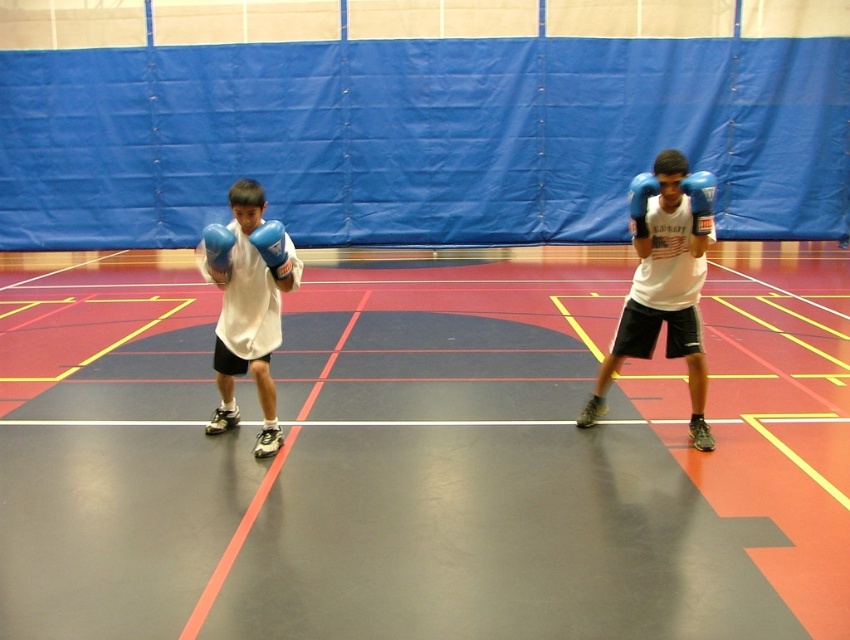
Question: Which object appears closest to the camera in this image?

Choices:
 (A) blue matte boxing glove at upper right
 (B) blue synthetic boxing glove at right

Answer: (A)

Question: Which of the following is the closest to the observer?

Choices:
 (A) blue synthetic boxing glove at right
 (B) blue matte boxing glove at upper right
 (C) blue matte boxing glove at upper center
 (D) blue matte boxing glove at left

Answer: (B)

Question: Does blue matte boxing glove at upper right appear on the right side of blue matte boxing glove at left?

Choices:
 (A) no
 (B) yes

Answer: (B)

Question: Which point is closer to the camera?

Choices:
 (A) blue matte boxing glove at upper center
 (B) matte blue gloves at center
 (C) blue synthetic boxing glove at right
 (D) blue matte boxing glove at upper right

Answer: (B)

Question: Does blue matte boxing glove at upper right appear on the right side of blue matte boxing glove at left?

Choices:
 (A) yes
 (B) no

Answer: (A)

Question: Considering the relative positions of white matte shirt at left and blue matte boxing glove at upper center in the image provided, where is white matte shirt at left located with respect to blue matte boxing glove at upper center?

Choices:
 (A) below
 (B) above

Answer: (A)